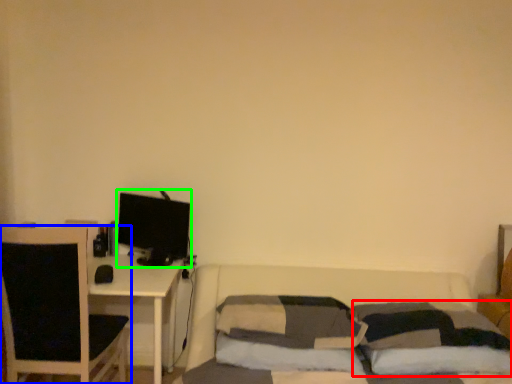
Question: Considering the real-world distances, which object is closest to pillow (highlighted by a red box)? chair (highlighted by a blue box) or computer monitor (highlighted by a green box).

Choices:
 (A) chair
 (B) computer monitor

Answer: (B)